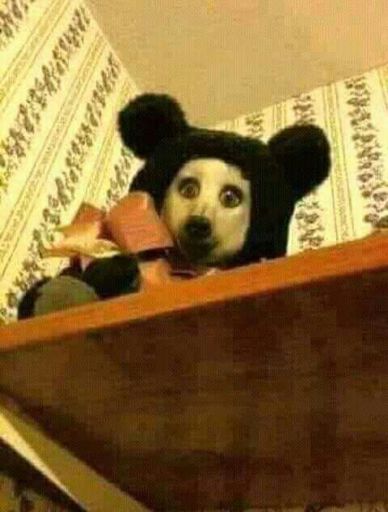
Find the location of a particular element. This screenshot has height=512, width=388. underside of shelf is located at coordinates (248, 432).